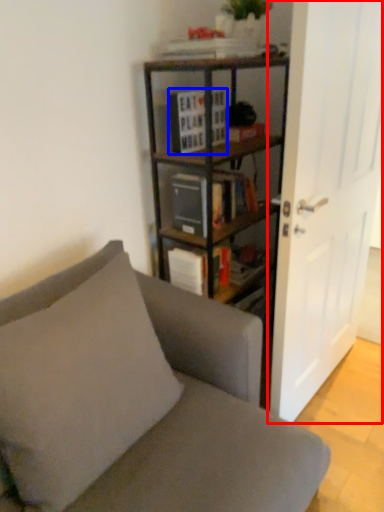
Question: Which point is closer to the camera, door (highlighted by a red box) or book (highlighted by a blue box)?

Choices:
 (A) door
 (B) book

Answer: (A)